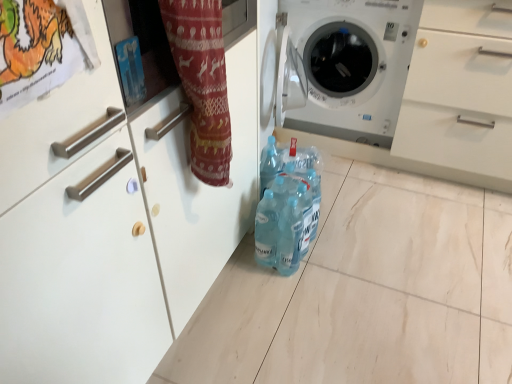
Question: Based on their positions, is white plastic washing machine at center located to the left or right of matte red fabric at center?

Choices:
 (A) left
 (B) right

Answer: (B)

Question: From the image's perspective, relative to matte red fabric at center, is white plastic washing machine at center above or below?

Choices:
 (A) below
 (B) above

Answer: (B)

Question: Estimate the real-world distances between objects in this image. Which object is farther from the white plastic washing machine at center?

Choices:
 (A) translucent plastic bottles at center
 (B) brushed metal drawer at upper left
 (C) matte red fabric at center

Answer: (B)

Question: Which of these objects is positioned farthest from the translucent plastic bottles at center?

Choices:
 (A) white plastic washing machine at center
 (B) matte red fabric at center
 (C) brushed metal drawer at upper left

Answer: (C)